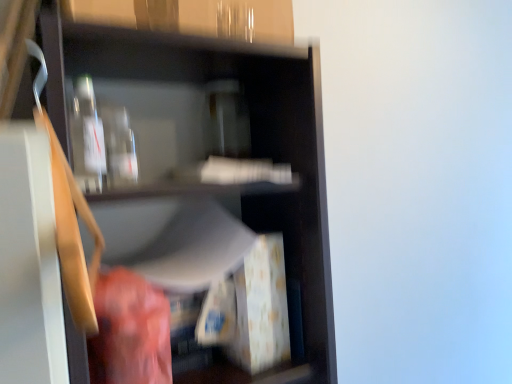
Question: Does point (267, 11) appear closer or farther from the camera than point (163, 235)?

Choices:
 (A) closer
 (B) farther

Answer: (A)

Question: Looking at their shapes, would you say transparent glass bottles at upper center is wider or thinner than matte black shelf at center?

Choices:
 (A) thin
 (B) wide

Answer: (A)

Question: Which of these objects is positioned closest to the transparent glass bottle at upper left?

Choices:
 (A) transparent glass bottles at upper center
 (B) matte black shelf at center

Answer: (A)

Question: Which is farther from the transparent glass bottle at upper left?

Choices:
 (A) matte black shelf at center
 (B) transparent glass bottles at upper center

Answer: (A)